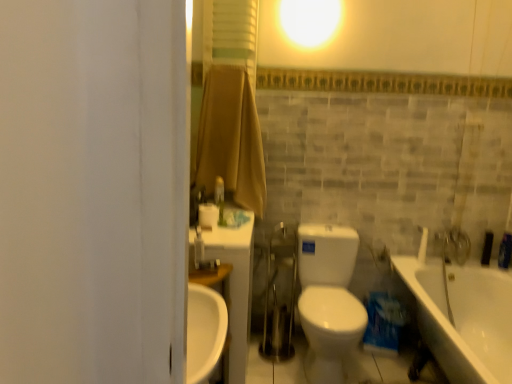
I want to click on free point to the right of white glossy faucet at upper right, so click(x=442, y=261).